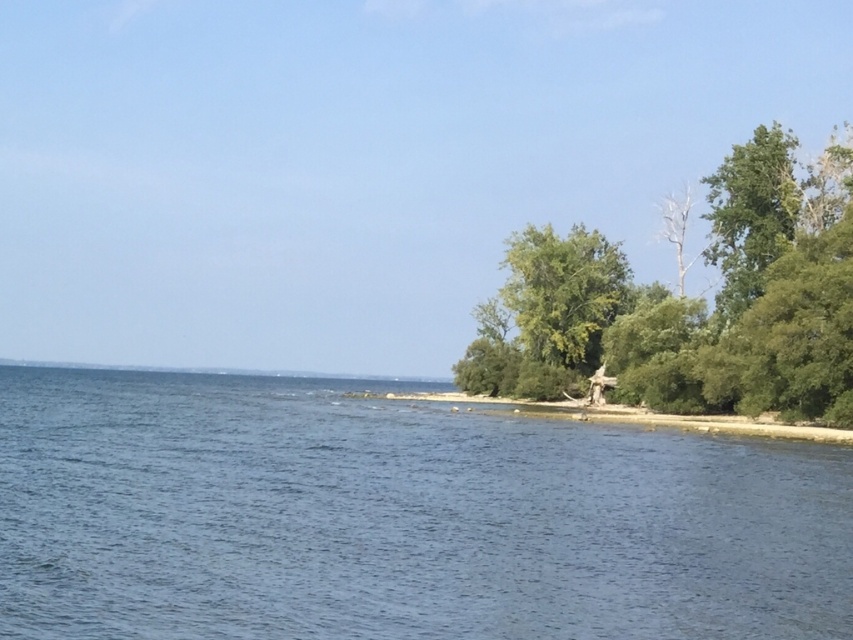
Who is more distant from viewer, (363,433) or (837,436)?

Positioned behind is point (363,433).

Does point (463, 550) lie in front of point (554, 410)?

Yes, point (463, 550) is closer to viewer.

This screenshot has height=640, width=853. Find the location of `blue water at center`. blue water at center is located at coordinates (397, 518).

Is green leafy tree at right positioned before green leafy vegetation at lower right?

That is False.

Is green leafy tree at right to the left of green leafy vegetation at lower right from the viewer's perspective?

In fact, green leafy tree at right is to the right of green leafy vegetation at lower right.

Does point (813, 336) lie in front of point (705, 419)?

Yes, point (813, 336) is closer to viewer.

Locate an element on the screen. The width and height of the screenshot is (853, 640). green leafy tree at right is located at coordinates (692, 301).

Is blue water at center closer to the viewer compared to green leafy tree at right?

That is True.

Who is positioned more to the left, blue water at center or green leafy tree at right?

Positioned to the left is blue water at center.

What do you see at coordinates (397, 518) in the screenshot? The height and width of the screenshot is (640, 853). I see `blue water at center` at bounding box center [397, 518].

The image size is (853, 640). I want to click on blue water at center, so click(397, 518).